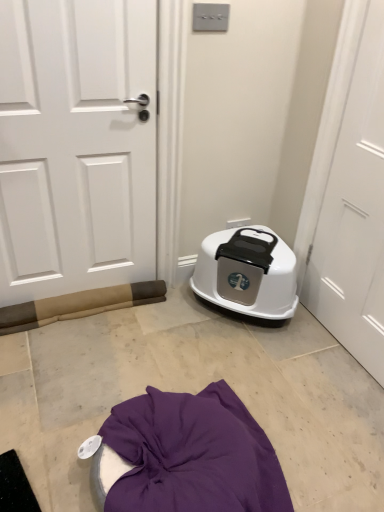
Identify the location of free location in front of white matte door at right, which is counted as the first door, starting from the right. The width and height of the screenshot is (384, 512). click(x=339, y=392).